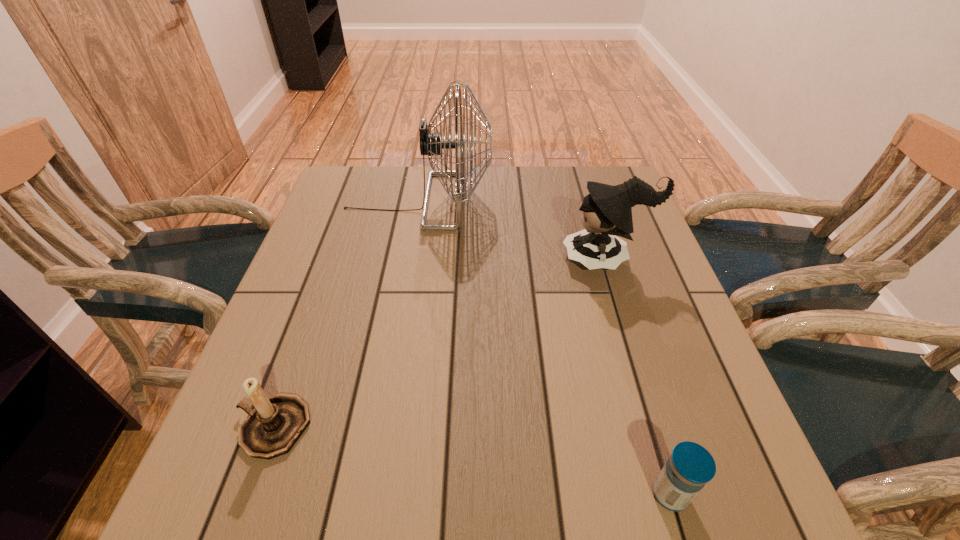
Image resolution: width=960 pixels, height=540 pixels. What are the coordinates of `blank area located at the face of the third shortest object` in the screenshot? It's located at (542, 259).

Identify the location of free space located 0.360m at the face of the third shortest object. The image size is (960, 540). (416, 259).

This screenshot has height=540, width=960. I want to click on vacant space located 0.350m on the right of the candle holder, so click(x=511, y=427).

The height and width of the screenshot is (540, 960). I want to click on free space located 0.360m on the back of the medicine, so click(x=615, y=309).

Locate an element on the screen. This screenshot has width=960, height=540. object situated at the far edge is located at coordinates (431, 144).

Locate an element on the screen. This screenshot has width=960, height=540. object located at the near edge is located at coordinates (690, 466).

The height and width of the screenshot is (540, 960). I want to click on fan that is at the left edge, so click(x=431, y=144).

The image size is (960, 540). Identify the location of candle holder situated at the left edge. (276, 423).

Locate an element on the screen. doll that is at the right edge is located at coordinates (607, 211).

You are a GUI agent. You are given a task and a screenshot of the screen. Output one action in this format:
    pyautogui.click(x=<x>, y=<y>)
    Task: Click on the medicine that is positioned at the right edge
    The height and width of the screenshot is (540, 960).
    Given the screenshot: What is the action you would take?
    pyautogui.click(x=690, y=466)